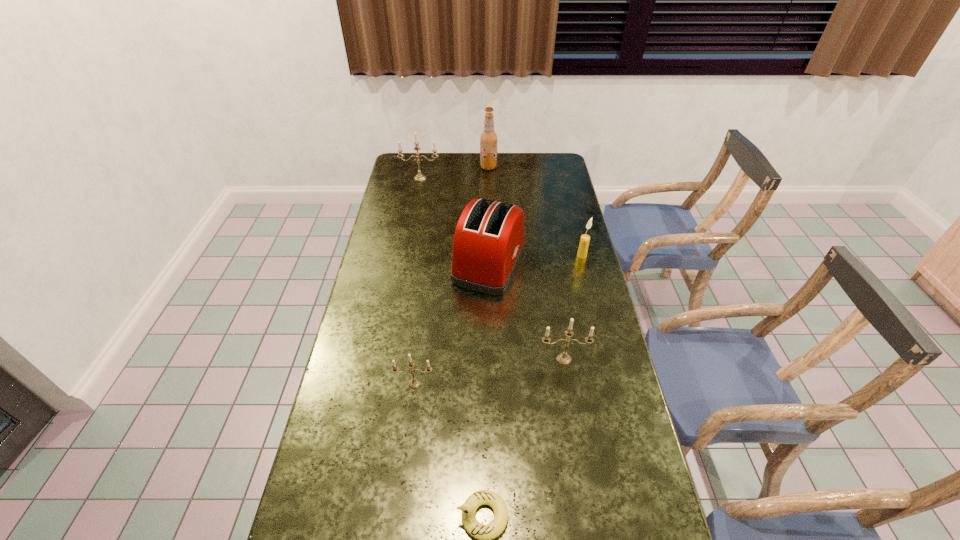
This screenshot has height=540, width=960. Find the location of `free space that is in between the cream candle and the sixth tallest object`. free space that is in between the cream candle and the sixth tallest object is located at coordinates (498, 320).

You are a GUI agent. You are given a task and a screenshot of the screen. Output one action in this format:
    pyautogui.click(x=<x>, y=<y>)
    Task: Click on the empty location between the cream candle and the toaster
    
    Given the screenshot: What is the action you would take?
    pyautogui.click(x=536, y=259)

The width and height of the screenshot is (960, 540). I want to click on free point between the sixth object from left to right and the farthest object, so click(526, 263).

You are a GUI agent. You are given a task and a screenshot of the screen. Output one action in this format:
    pyautogui.click(x=<x>, y=<y>)
    Task: Click on the unoccupied position between the biggest metallic candle and the tallest object
    The width and height of the screenshot is (960, 540).
    Given the screenshot: What is the action you would take?
    pyautogui.click(x=454, y=173)

At what (x,y) coordinates should I click in order to perform the action: click on object that is the fifth nearest to the duckling. Please return your answer as a coordinate pair (x, y). Looking at the image, I should click on 419,177.

Find the location of `object that stands as the third closest to the second nearest metallic candle`. object that stands as the third closest to the second nearest metallic candle is located at coordinates (485, 533).

Locate which candle ranks third in proximity to the red toaster. Please provide its 2D coordinates. Your answer should be formatted as a tuple, i.e. [(x, y)], where the tuple contains the x and y coordinates of a point satisfying the conditions above.

[(414, 382)]

The height and width of the screenshot is (540, 960). Identify the location of candle identified as the fourth closest to the yellow duckling. (419, 177).

Where is `metallic candle object that ranks as the closest to the tallest object`? Image resolution: width=960 pixels, height=540 pixels. metallic candle object that ranks as the closest to the tallest object is located at coordinates (419, 177).

Identify which metallic candle is the second closest to the nearest metallic candle. Please provide its 2D coordinates. Your answer should be formatted as a tuple, i.e. [(x, y)], where the tuple contains the x and y coordinates of a point satisfying the conditions above.

[(419, 177)]